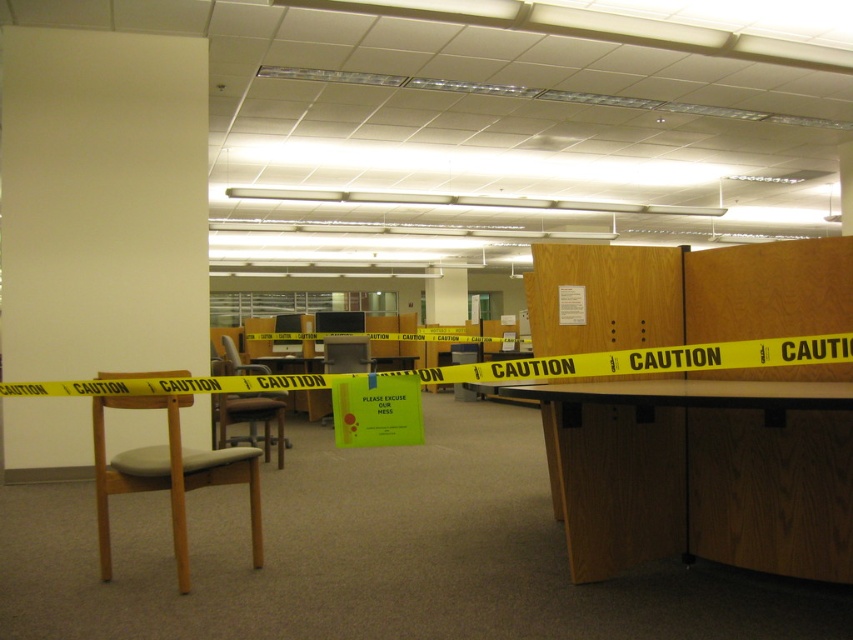
Question: Based on their relative distances, which object is nearer to the wooden chair at left?

Choices:
 (A) wooden table at lower right
 (B) light brown wood swivel chair at left

Answer: (B)

Question: Is light brown wood swivel chair at left smaller than wooden chair at left?

Choices:
 (A) yes
 (B) no

Answer: (B)

Question: Considering the real-world distances, which object is farthest from the wooden table at lower right?

Choices:
 (A) light brown wood swivel chair at left
 (B) wooden chair at left

Answer: (B)

Question: Can you confirm if wooden table at lower right is thinner than wooden chair at left?

Choices:
 (A) no
 (B) yes

Answer: (A)

Question: Estimate the real-world distances between objects in this image. Which object is closer to the wooden table at lower right?

Choices:
 (A) light brown wood swivel chair at left
 (B) wooden chair at left

Answer: (A)

Question: Does wooden table at lower right appear on the left side of light brown wood swivel chair at left?

Choices:
 (A) yes
 (B) no

Answer: (B)